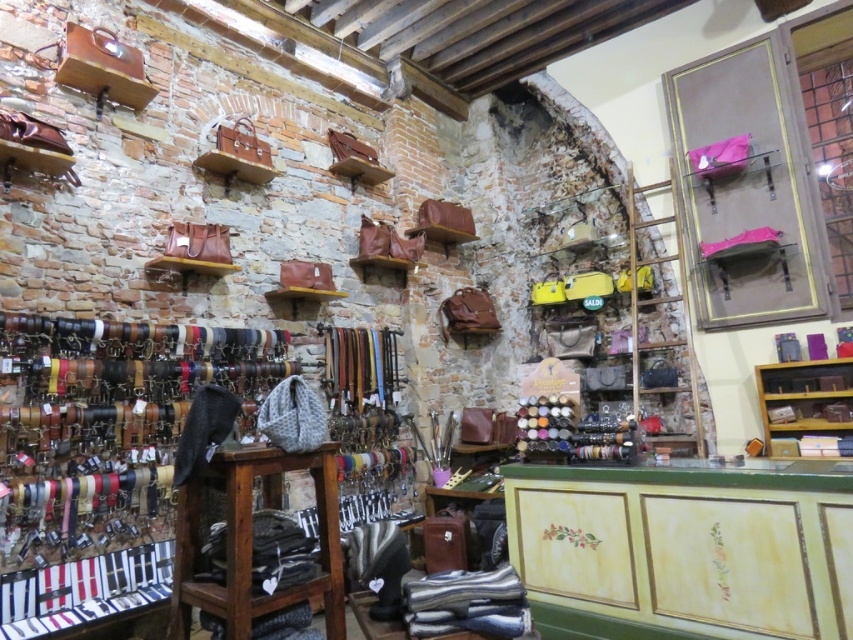
Between wooden stool at center and wooden shelf at right, which one has less height?

With less height is wooden shelf at right.

Is wooden stool at center smaller than wooden shelf at right?

No, wooden stool at center is not smaller than wooden shelf at right.

Is point (236, 612) less distant than point (808, 364)?

That is True.

Locate an element on the screen. The image size is (853, 640). wooden stool at center is located at coordinates (251, 540).